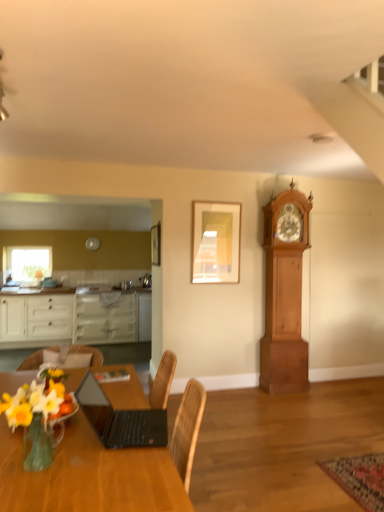
Question: From the image's perspective, is matte gold picture frame at upper center, arranged as the first picture frame when viewed from the right, above or below wooden chair at lower left?

Choices:
 (A) above
 (B) below

Answer: (A)

Question: From a real-world perspective, is matte gold picture frame at upper center, the second picture frame positioned from the left, above or below wooden chair at lower left?

Choices:
 (A) above
 (B) below

Answer: (A)

Question: Estimate the real-world distances between objects in this image. Which object is farther from the matte wood picture frame at upper center, positioned as the 1th picture frame in left-to-right order?

Choices:
 (A) matte gold picture frame at upper center, the second picture frame positioned from the left
 (B) wooden chair at lower left
 (C) white glossy cabinets at left
 (D) translucent glass vase at lower left
 (E) wooden table at lower left

Answer: (D)

Question: Which object is the closest to the matte gold picture frame at upper center, the second picture frame positioned from the left?

Choices:
 (A) black matte laptop at center
 (B) white glossy cabinets at left
 (C) wooden table at lower left
 (D) wooden chair at lower left
 (E) matte wood picture frame at upper center, positioned as the 1th picture frame in left-to-right order

Answer: (E)